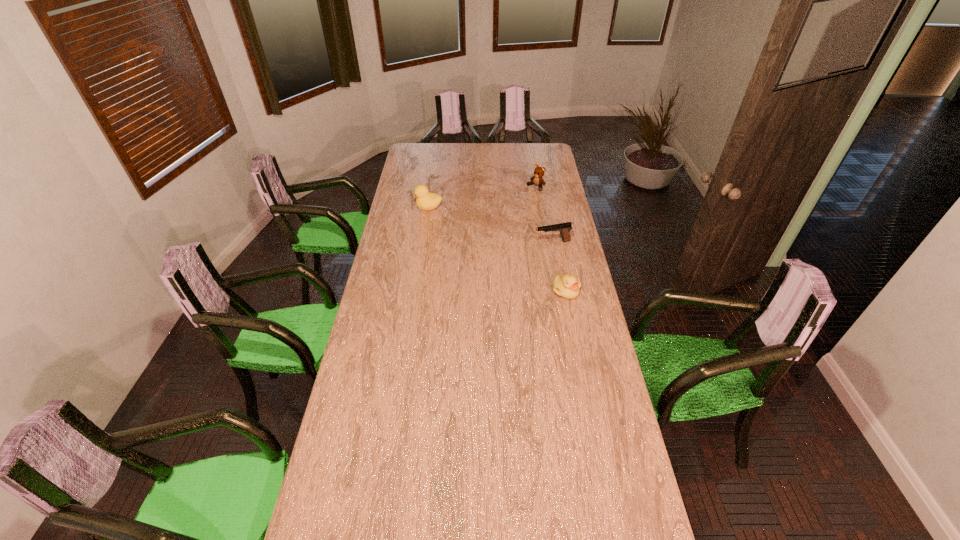
You are a GUI agent. You are given a task and a screenshot of the screen. Output one action in this format:
    pyautogui.click(x=<x>, y=<y>)
    Task: Click on the free space on the desktop that is between the third nearest object and the duckling and is positioned on the front-facing side of the farthest object
    The image size is (960, 540).
    Given the screenshot: What is the action you would take?
    pyautogui.click(x=471, y=234)

Locate an element on the screen. free space on the desktop that is between the second farthest object and the nearest object and is positioned at the muzzle of the second nearest object is located at coordinates (502, 252).